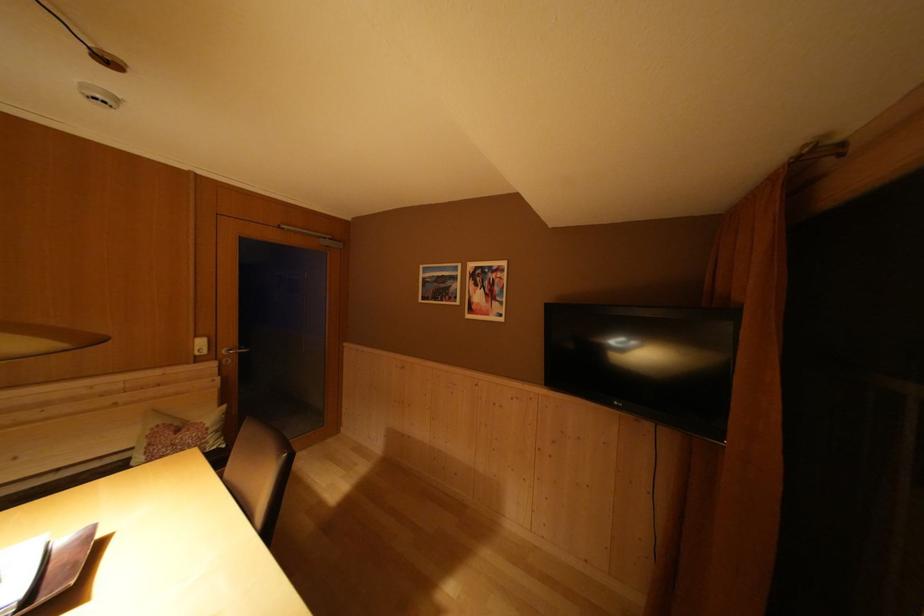
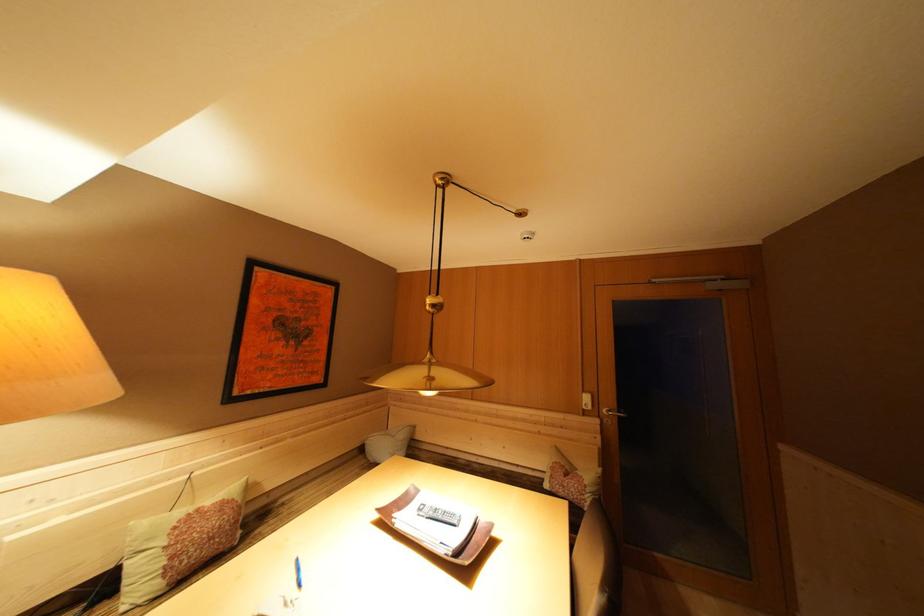
Where in the second image is the point corresponding to the point at 214,430 from the first image?

(592, 487)